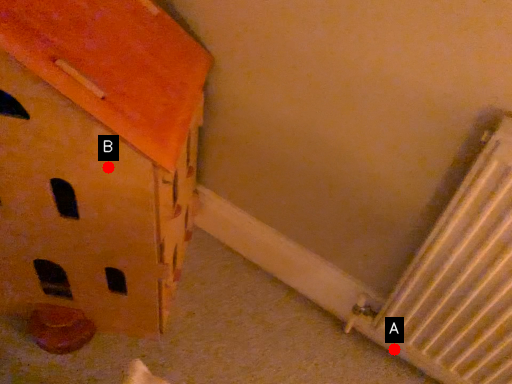
Question: Two points are circled on the image, labeled by A and B beside each circle. Which point is farther from the camera taking this photo?

Choices:
 (A) A is further
 (B) B is further

Answer: (A)